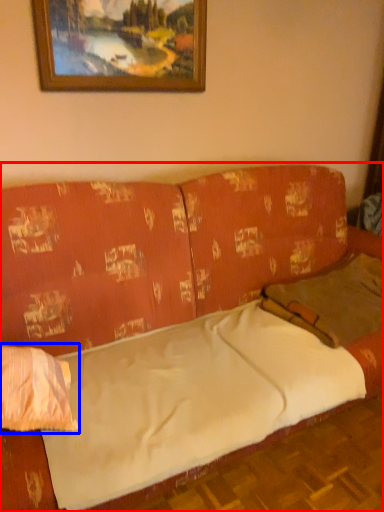
Question: Which object appears farthest to the camera in this image, studio couch (highlighted by a red box) or pillow (highlighted by a blue box)?

Choices:
 (A) studio couch
 (B) pillow

Answer: (B)